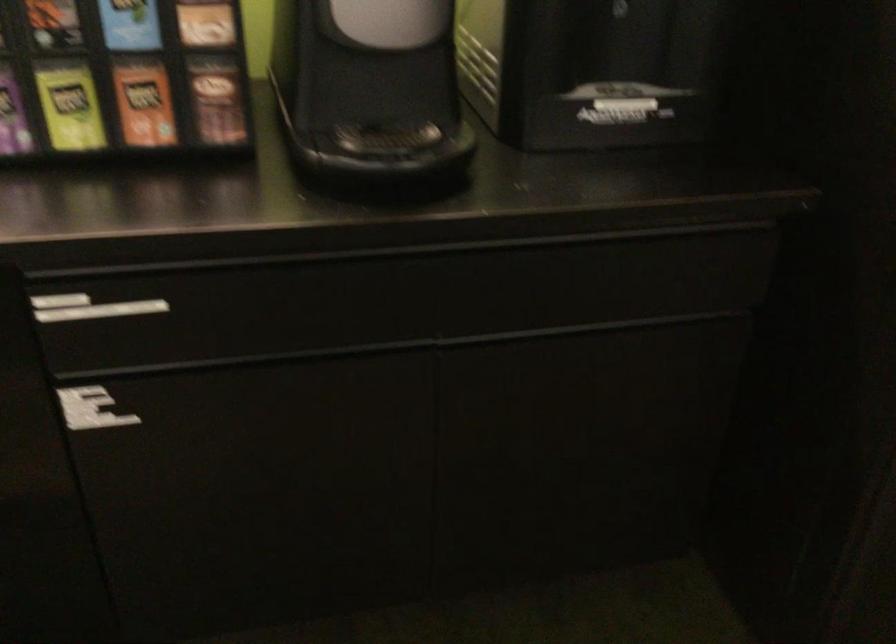
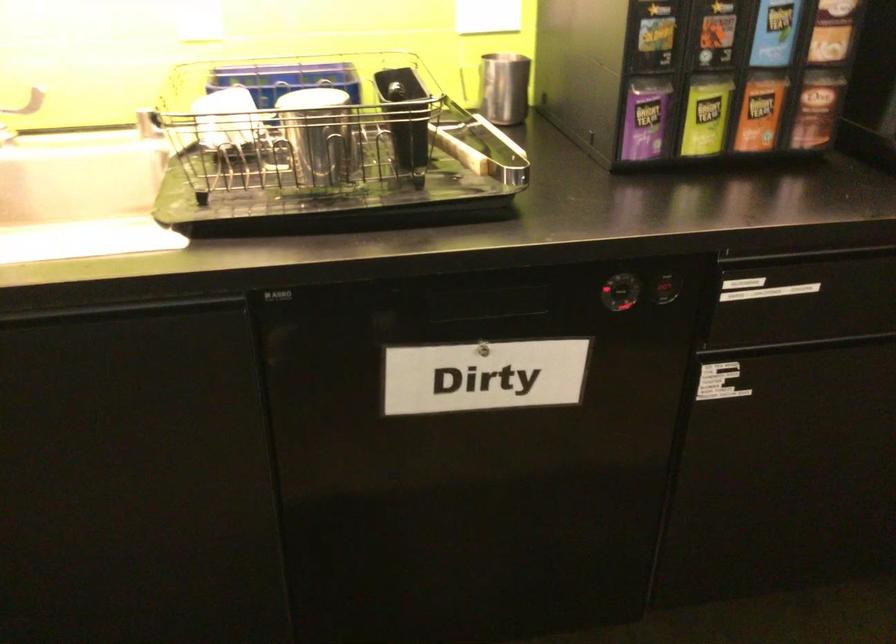
Locate, in the second image, the point that corresponds to the point at 217,104 in the first image.

(816, 109)